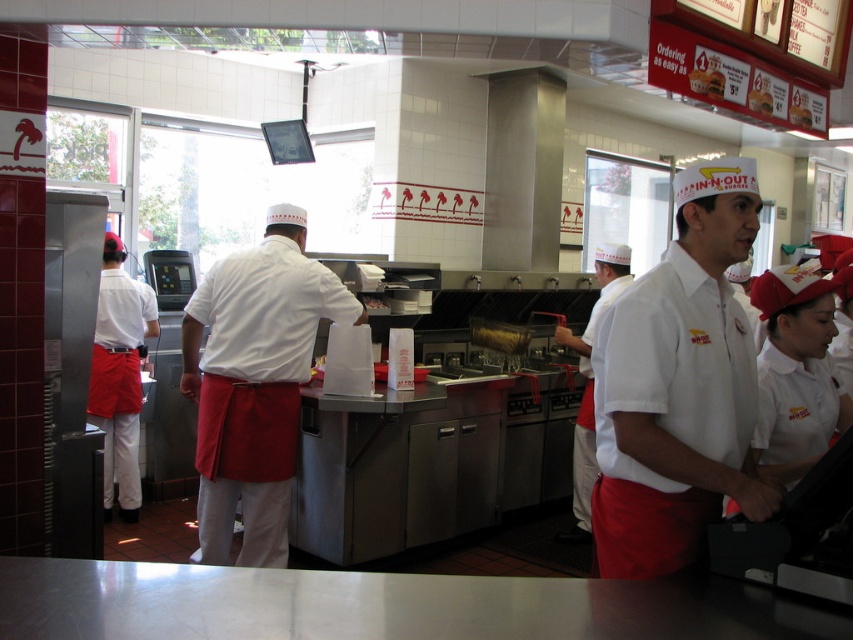
From the picture: Which is more to the right, white matte shirt at center or brown leather wallet at center?

white matte shirt at center is more to the right.

Is point (648, 468) farther from camera compared to point (518, 352)?

No, (648, 468) is in front of (518, 352).

Which is in front, point (647, 456) or point (480, 332)?

Positioned in front is point (647, 456).

This screenshot has width=853, height=640. Find the location of `white matte shirt at center`. white matte shirt at center is located at coordinates (677, 387).

Can you confirm if matte red apron at left is positioned to the right of brown leather wallet at center?

No, matte red apron at left is not to the right of brown leather wallet at center.

Is point (123, 456) positioned in front of point (503, 332)?

That is True.

Locate an element on the screen. Image resolution: width=853 pixels, height=640 pixels. matte red apron at left is located at coordinates (119, 376).

In the scene shown: Can you confirm if white matte apron at center is shorter than matte red apron at left?

Correct, white matte apron at center is not as tall as matte red apron at left.

Between white matte apron at center and matte red apron at left, which one is positioned higher?

white matte apron at center

Is point (267, 564) closer to camera compared to point (114, 307)?

Yes, point (267, 564) is in front of point (114, 307).

Identify the location of white matte apron at center. Image resolution: width=853 pixels, height=640 pixels. (254, 381).